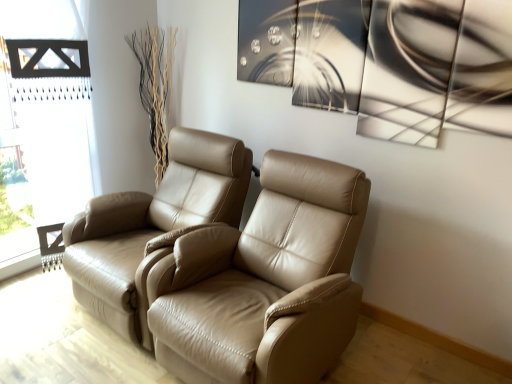
Question: Does tan leather recliner at center, the first chair positioned from the right, have a greater height compared to black wooden frame at left?

Choices:
 (A) no
 (B) yes

Answer: (A)

Question: Is tan leather recliner at center, acting as the 2th chair starting from the left, smaller than black wooden frame at left?

Choices:
 (A) no
 (B) yes

Answer: (A)

Question: Is tan leather recliner at center, the first chair positioned from the right, far away from black wooden frame at left?

Choices:
 (A) no
 (B) yes

Answer: (B)

Question: Is tan leather recliner at center, acting as the 2th chair starting from the left, aimed at black wooden frame at left?

Choices:
 (A) no
 (B) yes

Answer: (A)

Question: Is tan leather recliner at center, acting as the 2th chair starting from the left, positioned with its back to black wooden frame at left?

Choices:
 (A) yes
 (B) no

Answer: (B)

Question: From a real-world perspective, relative to black wooden frame at left, is tan leather chair at left, arranged as the second chair when viewed from the right, vertically above or below?

Choices:
 (A) below
 (B) above

Answer: (A)

Question: Would you say tan leather chair at left, arranged as the second chair when viewed from the right, is to the left or to the right of black wooden frame at left in the picture?

Choices:
 (A) left
 (B) right

Answer: (B)

Question: Looking at their shapes, would you say tan leather chair at left, arranged as the second chair when viewed from the right, is wider or thinner than black wooden frame at left?

Choices:
 (A) wide
 (B) thin

Answer: (A)

Question: Is point (122, 206) closer or farther from the camera than point (89, 157)?

Choices:
 (A) closer
 (B) farther

Answer: (A)

Question: Relative to tan leather chair at left, the first chair in the left-to-right sequence, is black wooden frame at left in front or behind?

Choices:
 (A) behind
 (B) front

Answer: (A)

Question: Considering the positions of black wooden frame at left and tan leather chair at left, arranged as the second chair when viewed from the right, in the image, is black wooden frame at left taller or shorter than tan leather chair at left, arranged as the second chair when viewed from the right,?

Choices:
 (A) short
 (B) tall

Answer: (B)

Question: Looking at their shapes, would you say black wooden frame at left is wider or thinner than tan leather chair at left, the first chair in the left-to-right sequence?

Choices:
 (A) wide
 (B) thin

Answer: (B)

Question: Is black wooden frame at left to the left or to the right of tan leather chair at left, the first chair in the left-to-right sequence, in the image?

Choices:
 (A) right
 (B) left

Answer: (B)

Question: Does point (335, 337) appear closer or farther from the camera than point (74, 114)?

Choices:
 (A) closer
 (B) farther

Answer: (A)

Question: Looking at the image, does tan leather recliner at center, acting as the 2th chair starting from the left, seem bigger or smaller compared to black wooden frame at left?

Choices:
 (A) big
 (B) small

Answer: (A)